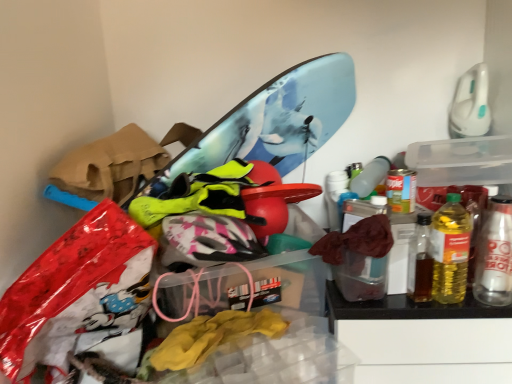
Question: From a real-world perspective, is transparent plastic storage box at center, the first storage box positioned from the bottom, physically below translucent plastic bottle at right, the 1th bottle viewed from the left?

Choices:
 (A) yes
 (B) no

Answer: (A)

Question: Is the depth of transparent plastic storage box at center, the first storage box positioned from the bottom, greater than that of translucent plastic bottle at right, the 1th bottle viewed from the left?

Choices:
 (A) yes
 (B) no

Answer: (B)

Question: Is transparent plastic storage box at center, placed as the second storage box when sorted from top to bottom, touching translucent plastic bottle at right, the 1th bottle viewed from the left?

Choices:
 (A) yes
 (B) no

Answer: (B)

Question: Does transparent plastic storage box at center, placed as the second storage box when sorted from top to bottom, have a larger size compared to translucent plastic bottle at right, the 1th bottle viewed from the left?

Choices:
 (A) no
 (B) yes

Answer: (B)

Question: Is transparent plastic storage box at center, placed as the second storage box when sorted from top to bottom, located outside translucent plastic bottle at right, the 2th bottle in the right-to-left sequence?

Choices:
 (A) no
 (B) yes

Answer: (B)

Question: Is transparent plastic storage box at center, arranged as the first storage box when viewed from the left, taller or shorter than metallic silver can at right, which appears as the 1th bottle when viewed from the right?

Choices:
 (A) short
 (B) tall

Answer: (B)

Question: Is transparent plastic storage box at center, which is the 2th storage box from right to left, inside the boundaries of metallic silver can at right, which appears as the 1th bottle when viewed from the right, or outside?

Choices:
 (A) outside
 (B) inside

Answer: (A)

Question: Would you say transparent plastic storage box at center, the first storage box positioned from the bottom, is to the left or to the right of metallic silver can at right, which appears as the 1th bottle when viewed from the right, in the picture?

Choices:
 (A) right
 (B) left

Answer: (B)

Question: From the image's perspective, is transparent plastic storage box at center, arranged as the first storage box when viewed from the left, positioned above or below metallic silver can at right, which is the second bottle from left to right?

Choices:
 (A) above
 (B) below

Answer: (B)

Question: Considering the positions of translucent plastic bottle at right, the 1th bottle viewed from the left, and transparent plastic storage box at center, the first storage box positioned from the bottom, in the image, is translucent plastic bottle at right, the 1th bottle viewed from the left, taller or shorter than transparent plastic storage box at center, the first storage box positioned from the bottom,?

Choices:
 (A) tall
 (B) short

Answer: (B)

Question: Relative to transparent plastic storage box at center, placed as the second storage box when sorted from top to bottom, is translucent plastic bottle at right, the 1th bottle viewed from the left, in front or behind?

Choices:
 (A) behind
 (B) front

Answer: (A)

Question: Visually, is translucent plastic bottle at right, the 1th bottle viewed from the left, positioned to the left or to the right of transparent plastic storage box at center, the first storage box positioned from the bottom?

Choices:
 (A) left
 (B) right

Answer: (B)

Question: From a real-world perspective, is translucent plastic bottle at right, the 2th bottle in the right-to-left sequence, above or below transparent plastic storage box at center, arranged as the first storage box when viewed from the left?

Choices:
 (A) above
 (B) below

Answer: (A)

Question: From a real-world perspective, is translucent plastic bottle at right, the 2th bottle in the right-to-left sequence, positioned above or below metallic silver can at right, which appears as the 1th bottle when viewed from the right?

Choices:
 (A) above
 (B) below

Answer: (A)

Question: In the image, is translucent plastic bottle at right, the 1th bottle viewed from the left, positioned in front of or behind metallic silver can at right, which appears as the 1th bottle when viewed from the right?

Choices:
 (A) front
 (B) behind

Answer: (A)